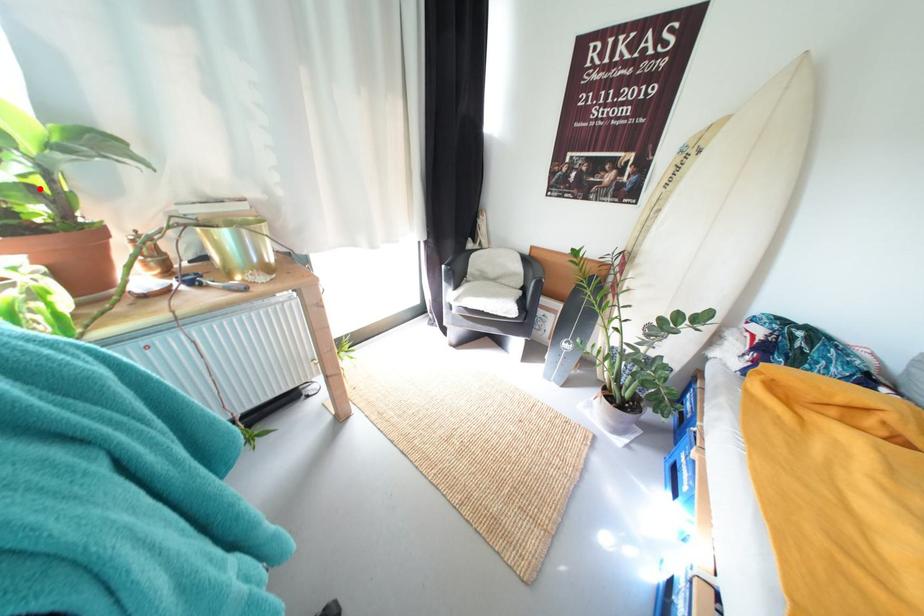
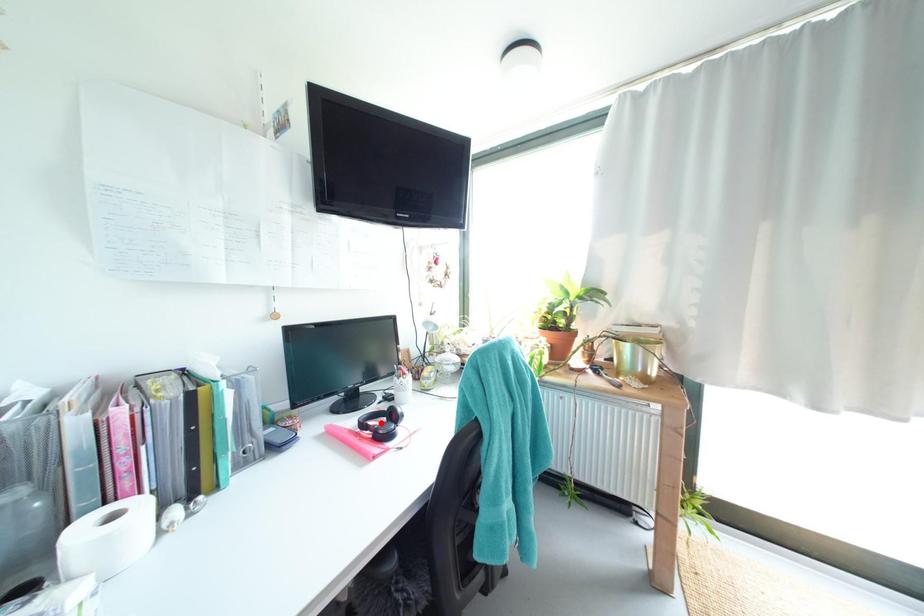
I am providing you with two images of the same scene from different viewpoints. A red point is marked on the first image and another point is marked on the second image. Does the point marked in image1 correspond to the same location as the one in image2?

No